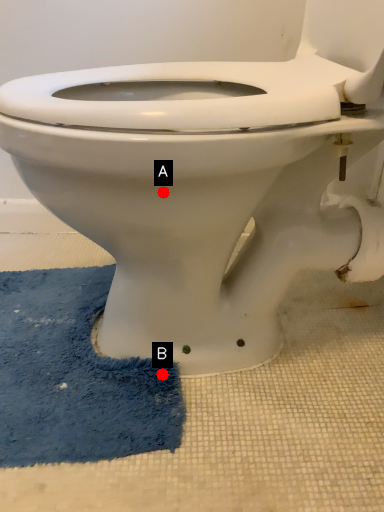
Question: Two points are circled on the image, labeled by A and B beside each circle. Which point is closer to the camera?

Choices:
 (A) A is closer
 (B) B is closer

Answer: (A)